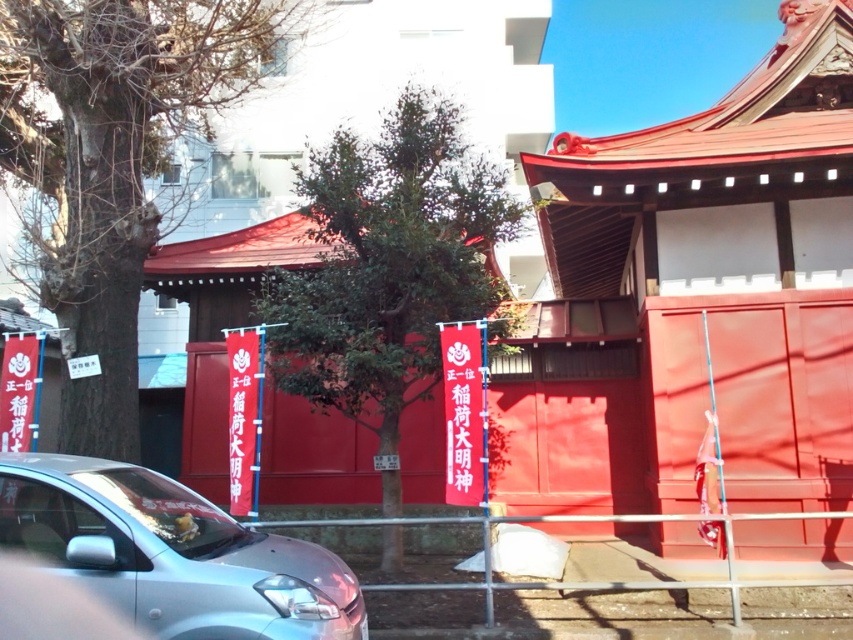
You are a photographer planning to capture the smooth red temple at center and the silver metallic car at lower left in a single frame. Given their sizes, which object would you position closer to the camera to ensure both fit within the frame?

The smooth red temple at center has a lesser width compared to the silver metallic car at lower left. To ensure both fit within the frame, you should position the silver metallic car at lower left closer to the camera since it is wider and requires more space.

You are a visitor at the shrine and want to take a photo of the smooth red temple at center without the silver metallic car at lower left blocking the view. Based on their positions, which side should you move to in order to avoid the car?

The smooth red temple at center is to the right of the silver metallic car at lower left. To avoid the car blocking the view, move to the left side of the car so that the temple remains visible to the right while the car is out of frame.